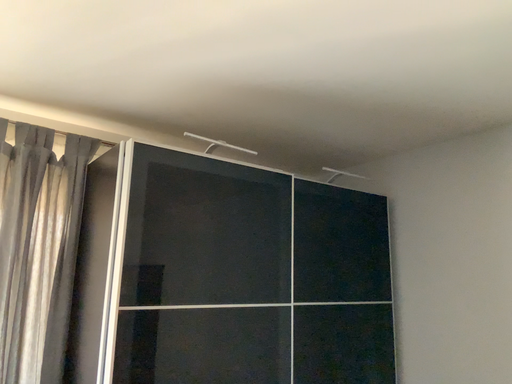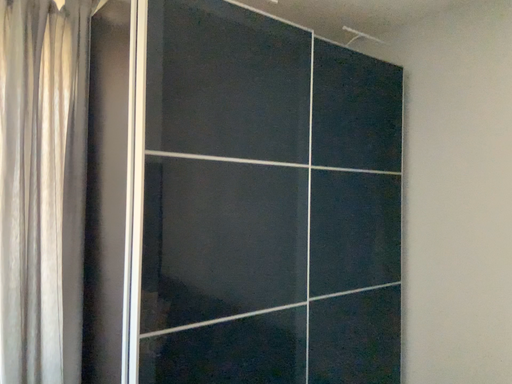
Question: How did the camera likely rotate when shooting the video?

Choices:
 (A) rotated upward
 (B) rotated downward

Answer: (B)